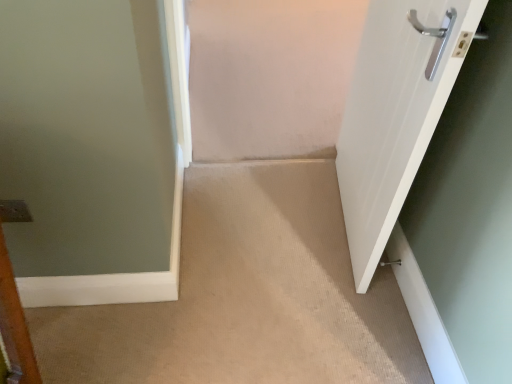
Question: Does white glossy door at right contain satin silver door handle at lower right?

Choices:
 (A) no
 (B) yes

Answer: (B)

Question: From the image's perspective, would you say white glossy door at right is shown under satin silver door handle at lower right?

Choices:
 (A) yes
 (B) no

Answer: (B)

Question: Considering the relative positions of white glossy door at right and satin silver door handle at lower right in the image provided, is white glossy door at right to the left of satin silver door handle at lower right from the viewer's perspective?

Choices:
 (A) no
 (B) yes

Answer: (B)

Question: Does white glossy door at right have a lesser height compared to satin silver door handle at lower right?

Choices:
 (A) no
 (B) yes

Answer: (A)

Question: Is white glossy door at right to the right of satin silver door handle at lower right from the viewer's perspective?

Choices:
 (A) yes
 (B) no

Answer: (B)

Question: Which is correct: white glossy door at right is inside beige carpet at center, or outside of it?

Choices:
 (A) inside
 (B) outside

Answer: (B)

Question: Looking at their shapes, would you say white glossy door at right is wider or thinner than beige carpet at center?

Choices:
 (A) wide
 (B) thin

Answer: (B)

Question: From their relative heights in the image, would you say white glossy door at right is taller or shorter than beige carpet at center?

Choices:
 (A) short
 (B) tall

Answer: (B)

Question: Considering the relative positions of white glossy door at right and beige carpet at center in the image provided, is white glossy door at right to the left or to the right of beige carpet at center?

Choices:
 (A) right
 (B) left

Answer: (A)

Question: Does point (418, 54) appear closer or farther from the camera than point (381, 264)?

Choices:
 (A) closer
 (B) farther

Answer: (A)

Question: Would you say white glossy door at right is inside or outside satin silver door handle at lower right?

Choices:
 (A) inside
 (B) outside

Answer: (B)

Question: From the image's perspective, relative to satin silver door handle at lower right, is white glossy door at right above or below?

Choices:
 (A) below
 (B) above

Answer: (B)

Question: Is white glossy door at right to the left or to the right of satin silver door handle at lower right in the image?

Choices:
 (A) right
 (B) left

Answer: (B)

Question: Is point (278, 354) closer or farther from the camera than point (396, 259)?

Choices:
 (A) closer
 (B) farther

Answer: (A)

Question: Is beige carpet at center to the left or to the right of satin silver door handle at lower right in the image?

Choices:
 (A) right
 (B) left

Answer: (B)